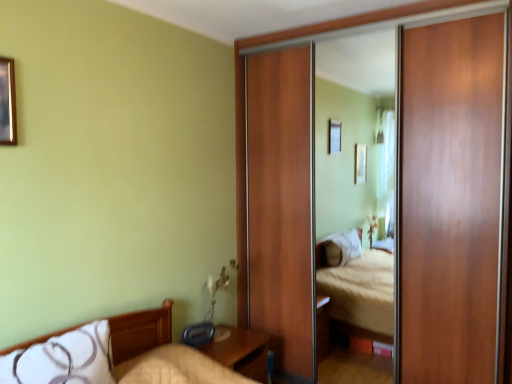
Question: Considering the positions of point (0, 109) and point (62, 372), is point (0, 109) closer or farther from the camera than point (62, 372)?

Choices:
 (A) closer
 (B) farther

Answer: (B)

Question: From a real-world perspective, is wooden picture frame at upper left positioned above or below white soft pillow at lower left?

Choices:
 (A) above
 (B) below

Answer: (A)

Question: Which of these objects is positioned farthest from the white soft pillow at lower left?

Choices:
 (A) wooden nightstand at lower center
 (B) wooden picture frame at upper left
 (C) wooden sliding door at right

Answer: (C)

Question: Which is farther from the wooden sliding door at right?

Choices:
 (A) wooden nightstand at lower center
 (B) white soft pillow at lower left
 (C) wooden picture frame at upper left

Answer: (C)